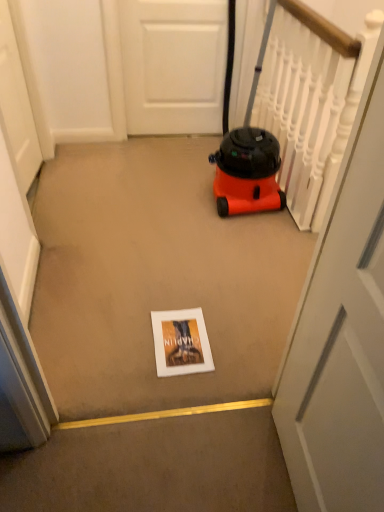
At what (x,y) coordinates should I click in order to perform the action: click on free space in front of orange matte vacuum cleaner at center-right. Please return your answer as a coordinate pair (x, y). Image resolution: width=384 pixels, height=512 pixels. Looking at the image, I should click on [x=208, y=230].